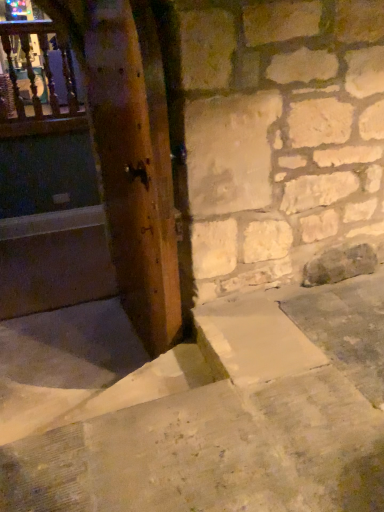
Locate an element on the screen. wooden door at left is located at coordinates (134, 164).

This screenshot has width=384, height=512. What do you see at coordinates (134, 164) in the screenshot? I see `wooden door at left` at bounding box center [134, 164].

Image resolution: width=384 pixels, height=512 pixels. I want to click on wooden door at left, so click(x=134, y=164).